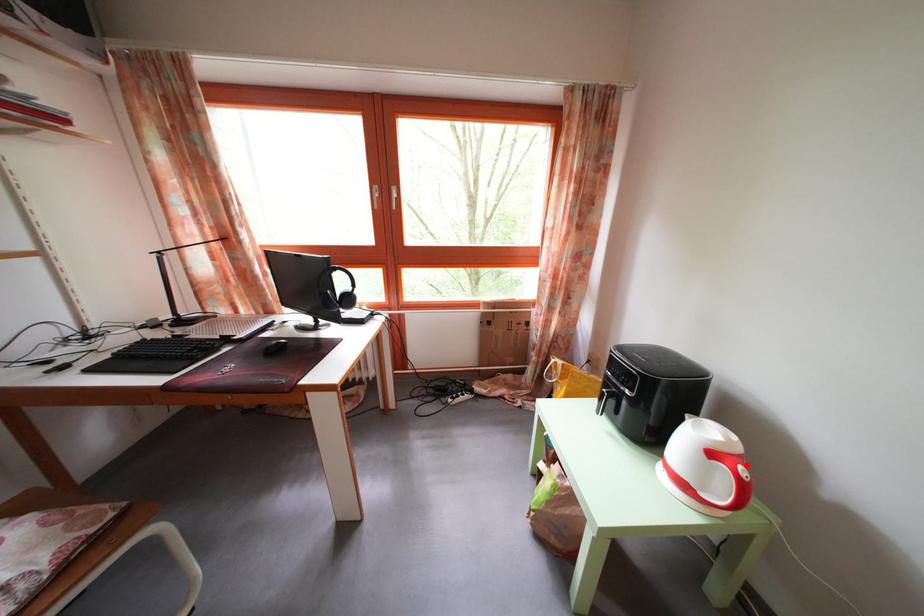
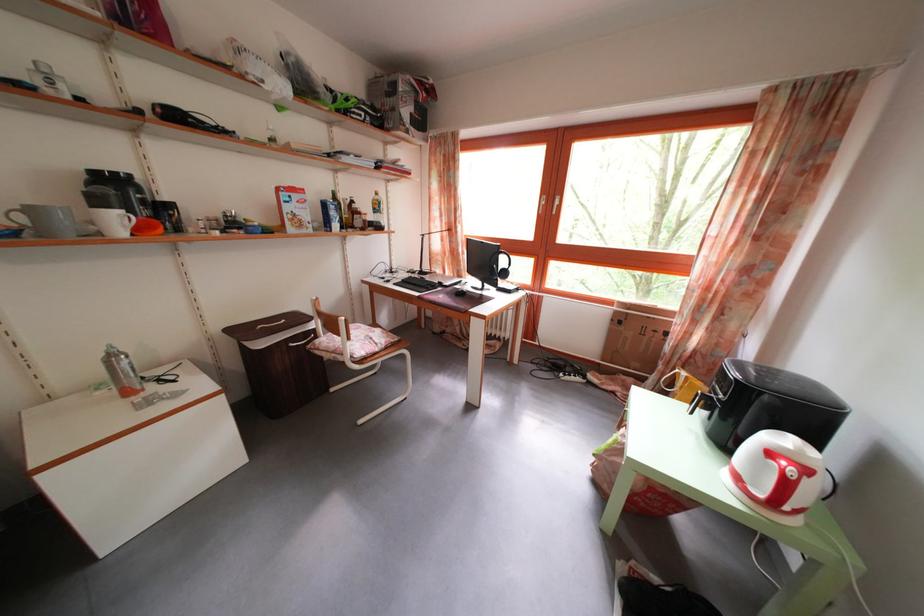
Find the pixel in the second image that matches the highlighted location in the first image.

(812, 477)